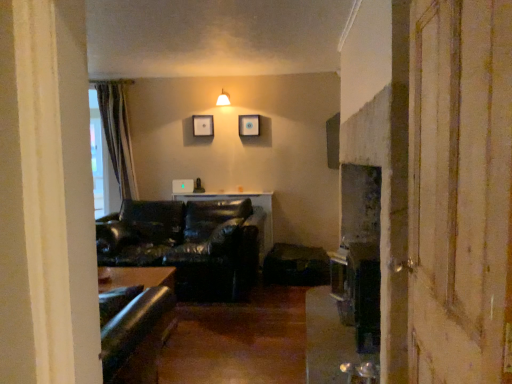
Question: From the image's perspective, relative to matte white lampshade at upper center, is matte black picture frame at upper center, which ranks as the second picture frame in right-to-left order, above or below?

Choices:
 (A) below
 (B) above

Answer: (A)

Question: Is matte black picture frame at upper center, which ranks as the second picture frame in right-to-left order, wider or thinner than matte white lampshade at upper center?

Choices:
 (A) thin
 (B) wide

Answer: (A)

Question: Estimate the real-world distances between objects in this image. Which object is closer to the matte black picture frame at upper center, the 1th picture frame from the left?

Choices:
 (A) green striped curtain at left
 (B) wooden picture frame at upper center, arranged as the 2th picture frame when viewed from the left
 (C) leather couch at center
 (D) matte white lampshade at upper center
 (E) wooden screen door at right

Answer: (D)

Question: Which object is positioned farthest from the matte white lampshade at upper center?

Choices:
 (A) wooden screen door at right
 (B) leather couch at center
 (C) wooden picture frame at upper center, which ranks as the 1th picture frame in right-to-left order
 (D) matte black picture frame at upper center, which ranks as the second picture frame in right-to-left order
 (E) green striped curtain at left

Answer: (A)